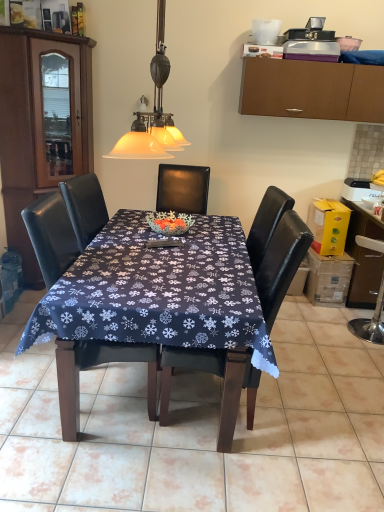
Image resolution: width=384 pixels, height=512 pixels. In order to click on free point in front of black leather chair at center, arranged as the 1th chair when viewed from the left in this screenshot , I will do `click(96, 459)`.